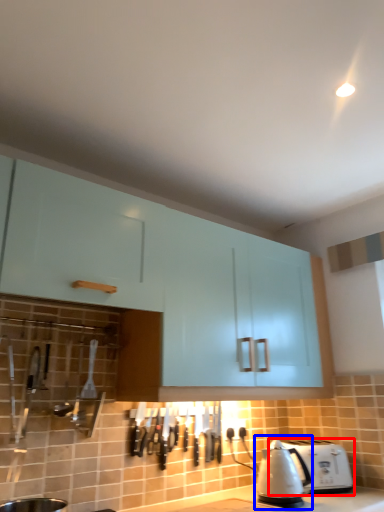
Question: Which of the following is the closest to the observer, toaster (highlighted by a red box) or kettle (highlighted by a blue box)?

Choices:
 (A) toaster
 (B) kettle

Answer: (B)